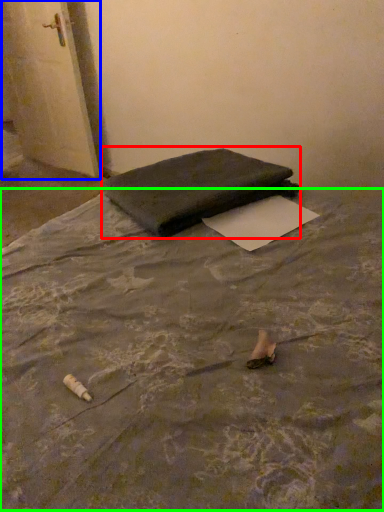
Question: Considering the real-world distances, which object is farthest from furniture (highlighted by a red box)? door (highlighted by a blue box) or mattress (highlighted by a green box)?

Choices:
 (A) door
 (B) mattress

Answer: (A)